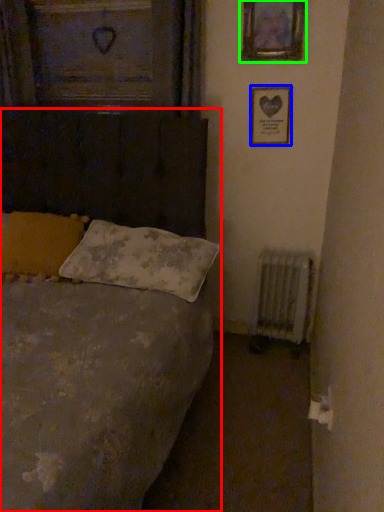
Question: Which object is the farthest from bed (highlighted by a red box)? Choose among these: picture frame (highlighted by a blue box) or picture frame (highlighted by a green box).

Choices:
 (A) picture frame
 (B) picture frame

Answer: (B)